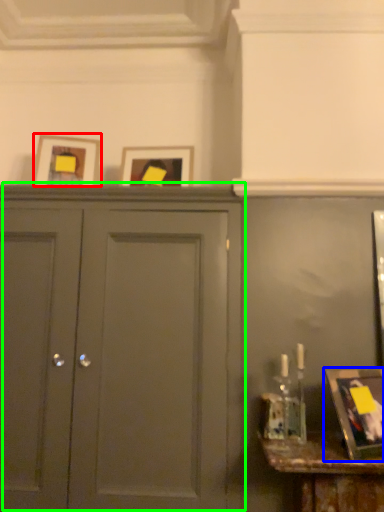
Question: Considering the real-world distances, which object is closest to picture frame (highlighted by a red box)? picture frame (highlighted by a blue box) or door (highlighted by a green box).

Choices:
 (A) picture frame
 (B) door

Answer: (B)